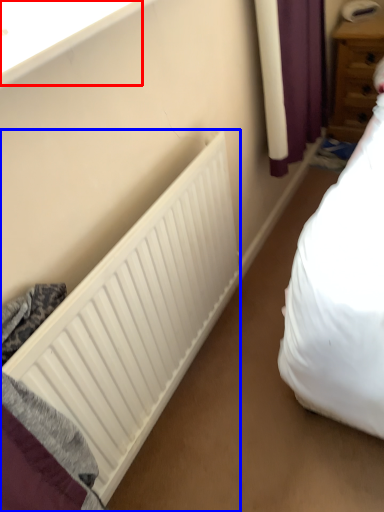
Question: Which object appears farthest to the camera in this image, window sill (highlighted by a red box) or radiator (highlighted by a blue box)?

Choices:
 (A) window sill
 (B) radiator

Answer: (B)